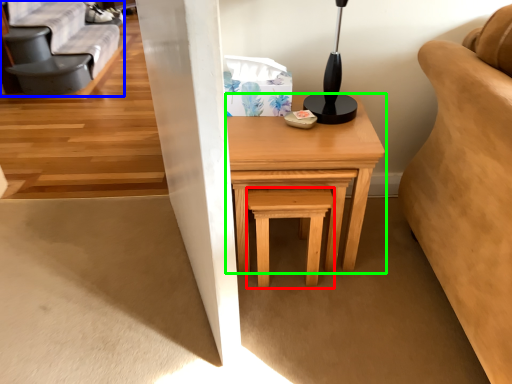
Question: Estimate the real-world distances between objects in this image. Which object is closer to stool (highlighted by a red box), futon (highlighted by a blue box) or table (highlighted by a green box)?

Choices:
 (A) futon
 (B) table

Answer: (B)